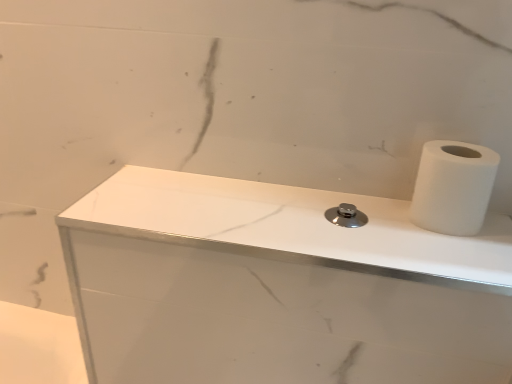
At what (x,y) coordinates should I click in order to perform the action: click on free space on the front side of white matte paper towel at right. Please return your answer as a coordinate pair (x, y). The image size is (512, 384). Looking at the image, I should click on (454, 252).